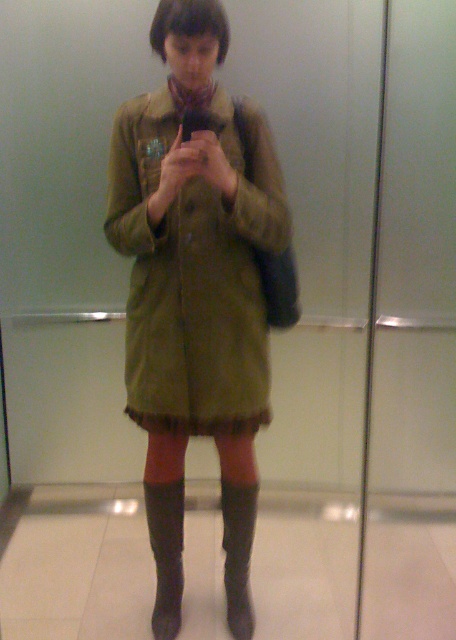
Question: Among these objects, which one is nearest to the camera?

Choices:
 (A) leather/knit boot at lower center
 (B) olive green fabric jacket at center
 (C) leather at lower center

Answer: (B)

Question: Does olive green fabric jacket at center appear over leather/knit boot at lower center?

Choices:
 (A) yes
 (B) no

Answer: (A)

Question: Can you confirm if olive green fabric jacket at center is positioned below leather at lower center?

Choices:
 (A) no
 (B) yes

Answer: (A)

Question: Among these objects, which one is farthest from the camera?

Choices:
 (A) olive green fabric jacket at center
 (B) leather/knit boot at lower center

Answer: (B)

Question: Which object appears closest to the camera in this image?

Choices:
 (A) leather/knit boot at lower center
 (B) leather at lower center
 (C) olive green fabric jacket at center

Answer: (C)

Question: Does olive green fabric jacket at center appear over leather/knit boot at lower center?

Choices:
 (A) yes
 (B) no

Answer: (A)